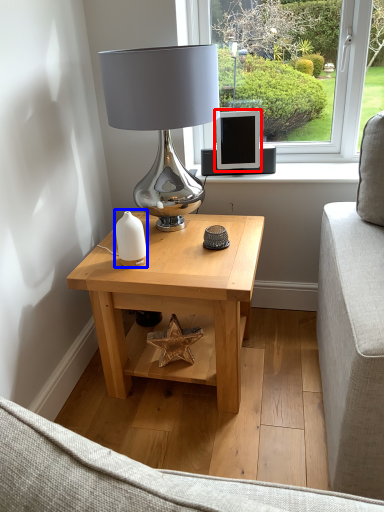
Question: Which object appears farthest to the camera in this image, computer monitor (highlighted by a red box) or candle holder (highlighted by a blue box)?

Choices:
 (A) computer monitor
 (B) candle holder

Answer: (A)